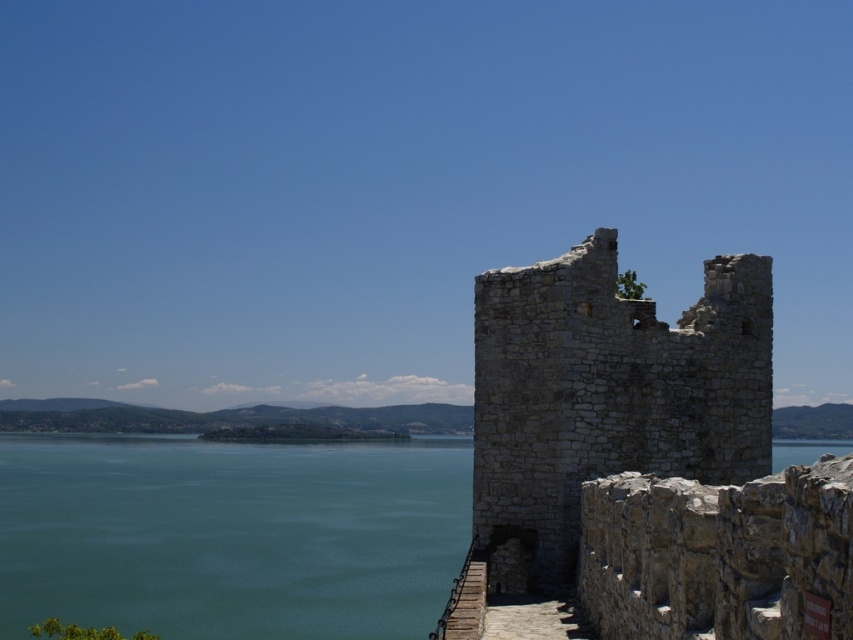
Question: Does green water at lower left have a larger size compared to gray stone ruins at center?

Choices:
 (A) no
 (B) yes

Answer: (B)

Question: Among these objects, which one is nearest to the camera?

Choices:
 (A) gray stone ruins at center
 (B) green water at lower left

Answer: (A)

Question: Is the position of green water at lower left more distant than that of gray stone ruins at center?

Choices:
 (A) yes
 (B) no

Answer: (A)

Question: Can you confirm if green water at lower left is thinner than gray stone ruins at center?

Choices:
 (A) no
 (B) yes

Answer: (A)

Question: Which point is closer to the camera?

Choices:
 (A) gray stone ruins at center
 (B) green water at lower left

Answer: (A)